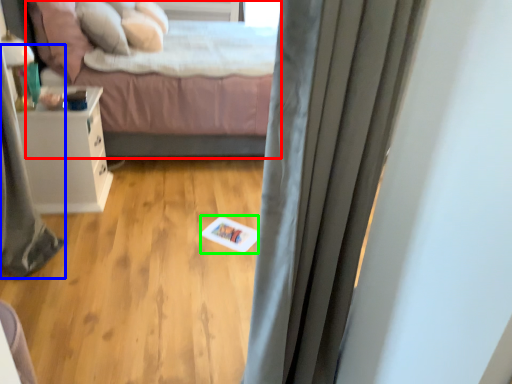
Question: Which object is the farthest from bed (highlighted by a red box)? Choose among these: shower curtain (highlighted by a blue box) or card (highlighted by a green box).

Choices:
 (A) shower curtain
 (B) card

Answer: (A)